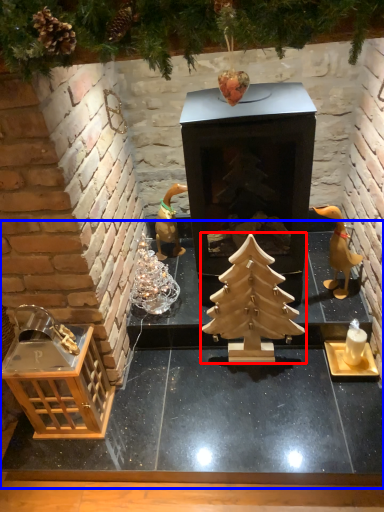
Question: Which object appears closest to the camera in this image, christmas tree (highlighted by a red box) or table (highlighted by a blue box)?

Choices:
 (A) christmas tree
 (B) table

Answer: (B)